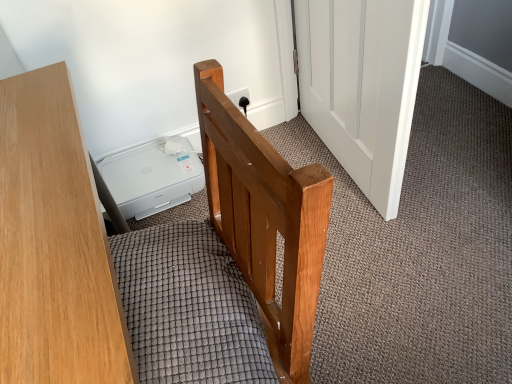
I want to click on free space below white wooden door at center (from a real-world perspective), so click(x=326, y=161).